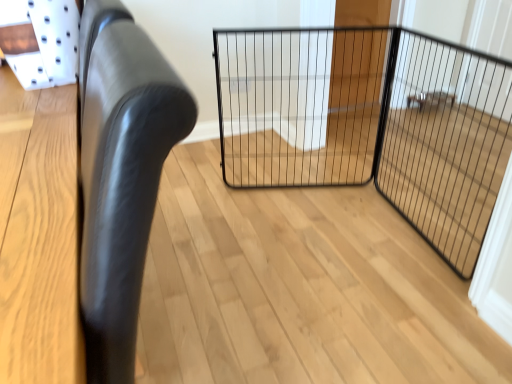
Question: Is black leather chair at left facing away from black wire mesh gate at center?

Choices:
 (A) yes
 (B) no

Answer: (B)

Question: Could you tell me if black leather chair at left is facing black wire mesh gate at center?

Choices:
 (A) no
 (B) yes

Answer: (A)

Question: Considering the relative sizes of black leather chair at left and black wire mesh gate at center in the image provided, is black leather chair at left thinner than black wire mesh gate at center?

Choices:
 (A) no
 (B) yes

Answer: (A)

Question: Is black leather chair at left further to camera compared to black wire mesh gate at center?

Choices:
 (A) yes
 (B) no

Answer: (B)

Question: Considering the relative sizes of black leather chair at left and black wire mesh gate at center in the image provided, is black leather chair at left smaller than black wire mesh gate at center?

Choices:
 (A) no
 (B) yes

Answer: (A)

Question: Considering the positions of black wire mesh screen door at center and black wire mesh gate at center in the image, is black wire mesh screen door at center wider or thinner than black wire mesh gate at center?

Choices:
 (A) wide
 (B) thin

Answer: (B)

Question: In terms of height, does black wire mesh screen door at center look taller or shorter compared to black wire mesh gate at center?

Choices:
 (A) short
 (B) tall

Answer: (A)

Question: From a real-world perspective, is black wire mesh screen door at center positioned above or below black wire mesh gate at center?

Choices:
 (A) below
 (B) above

Answer: (B)

Question: Relative to black wire mesh gate at center, is black wire mesh screen door at center in front or behind?

Choices:
 (A) behind
 (B) front

Answer: (B)

Question: From the image's perspective, relative to black leather chair at left, is black wire mesh screen door at center above or below?

Choices:
 (A) below
 (B) above

Answer: (B)

Question: Is black wire mesh screen door at center situated inside black leather chair at left or outside?

Choices:
 (A) outside
 (B) inside

Answer: (A)

Question: Based on their positions, is black wire mesh screen door at center located to the left or right of black leather chair at left?

Choices:
 (A) left
 (B) right

Answer: (B)

Question: Considering the positions of black wire mesh screen door at center and black leather chair at left in the image, is black wire mesh screen door at center wider or thinner than black leather chair at left?

Choices:
 (A) wide
 (B) thin

Answer: (B)

Question: In the image, is black leather chair at left on the left side or the right side of black wire mesh gate at center?

Choices:
 (A) left
 (B) right

Answer: (A)

Question: Considering the positions of point (157, 59) and point (335, 79), is point (157, 59) closer or farther from the camera than point (335, 79)?

Choices:
 (A) closer
 (B) farther

Answer: (A)